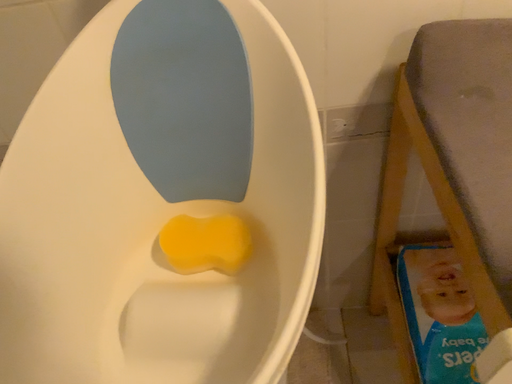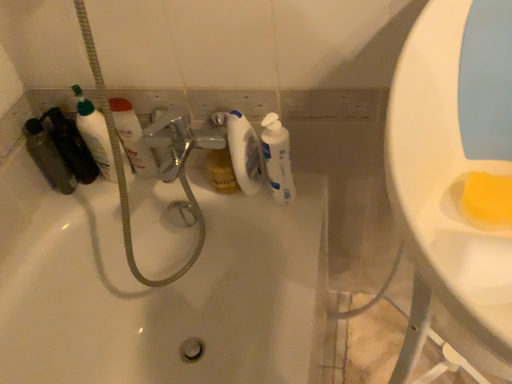
Question: How did the camera likely rotate when shooting the video?

Choices:
 (A) rotated left
 (B) rotated right

Answer: (A)